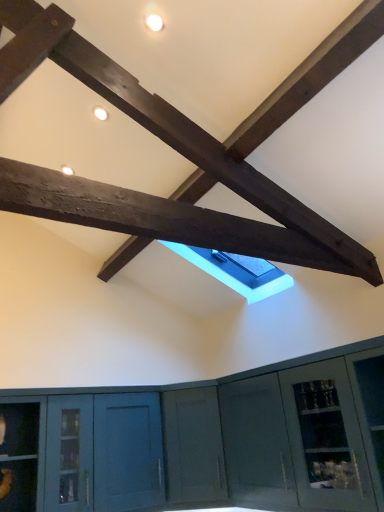
Describe the element at coordinates (158, 218) in the screenshot. I see `dark brown wood beam at center` at that location.

Find the location of a particular element. dark brown wood beam at center is located at coordinates (158, 218).

Identify the location of dark brown wood beam at center. The image size is (384, 512). (158, 218).